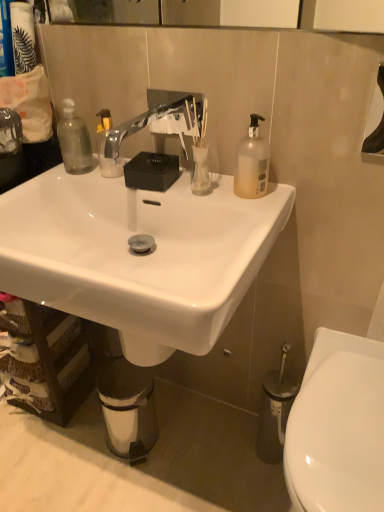
Question: Considering the relative positions of white glossy toilet at lower right and matte black canister at upper left in the image provided, is white glossy toilet at lower right in front of matte black canister at upper left?

Choices:
 (A) no
 (B) yes

Answer: (B)

Question: Would you say matte black canister at upper left is part of white glossy toilet at lower right's contents?

Choices:
 (A) yes
 (B) no

Answer: (B)

Question: Can you confirm if white glossy toilet at lower right is positioned to the right of matte black canister at upper left?

Choices:
 (A) no
 (B) yes

Answer: (B)

Question: Is white glossy toilet at lower right completely or partially outside of matte black canister at upper left?

Choices:
 (A) no
 (B) yes

Answer: (B)

Question: Does white glossy toilet at lower right come behind matte black canister at upper left?

Choices:
 (A) yes
 (B) no

Answer: (B)

Question: Can you confirm if white glossy toilet at lower right is positioned to the left of matte black canister at upper left?

Choices:
 (A) yes
 (B) no

Answer: (B)

Question: Are translucent plastic bottle at upper right and matte black canister at upper left far apart?

Choices:
 (A) yes
 (B) no

Answer: (B)

Question: Is translucent plastic bottle at upper right taller than matte black canister at upper left?

Choices:
 (A) yes
 (B) no

Answer: (B)

Question: Is translucent plastic bottle at upper right placed right next to matte black canister at upper left?

Choices:
 (A) yes
 (B) no

Answer: (B)

Question: Is translucent plastic bottle at upper right not within matte black canister at upper left?

Choices:
 (A) yes
 (B) no

Answer: (A)

Question: Does translucent plastic bottle at upper right have a smaller size compared to matte black canister at upper left?

Choices:
 (A) no
 (B) yes

Answer: (B)

Question: Is translucent plastic bottle at upper right closer to camera compared to matte black canister at upper left?

Choices:
 (A) yes
 (B) no

Answer: (A)

Question: Does brown woven basket at lower left have a smaller size compared to translucent plastic bottle at upper right?

Choices:
 (A) yes
 (B) no

Answer: (B)